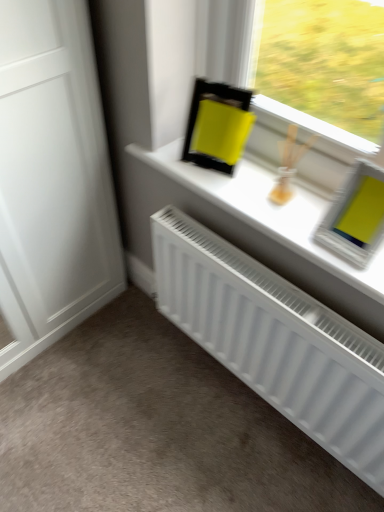
Question: Is white matte window sill at upper center inside white matte radiator at lower center?

Choices:
 (A) no
 (B) yes

Answer: (A)

Question: Is white matte radiator at lower center shorter than white matte window sill at upper center?

Choices:
 (A) yes
 (B) no

Answer: (B)

Question: Can you confirm if white matte radiator at lower center is thinner than white matte window sill at upper center?

Choices:
 (A) no
 (B) yes

Answer: (A)

Question: Is white matte radiator at lower center wider than white matte window sill at upper center?

Choices:
 (A) no
 (B) yes

Answer: (B)

Question: Can you confirm if white matte radiator at lower center is positioned to the right of white matte window sill at upper center?

Choices:
 (A) yes
 (B) no

Answer: (B)

Question: Is white matte radiator at lower center facing away from white matte window sill at upper center?

Choices:
 (A) no
 (B) yes

Answer: (A)

Question: Is white matte radiator at lower center outside of white matte window sill at upper center?

Choices:
 (A) yes
 (B) no

Answer: (A)

Question: Is white matte radiator at lower center positioned before white matte window sill at upper center?

Choices:
 (A) no
 (B) yes

Answer: (B)

Question: Considering the relative sizes of white matte radiator at lower center and white matte window sill at upper center in the image provided, is white matte radiator at lower center smaller than white matte window sill at upper center?

Choices:
 (A) no
 (B) yes

Answer: (A)

Question: From the image's perspective, is white matte radiator at lower center over white matte window sill at upper center?

Choices:
 (A) yes
 (B) no

Answer: (B)

Question: Can you confirm if white matte radiator at lower center is positioned to the left of white matte window sill at upper center?

Choices:
 (A) yes
 (B) no

Answer: (B)

Question: From the image's perspective, does white matte radiator at lower center appear lower than white matte window sill at upper center?

Choices:
 (A) no
 (B) yes

Answer: (B)

Question: Is white matte window sill at upper center facing away from white matte radiator at lower center?

Choices:
 (A) yes
 (B) no

Answer: (B)